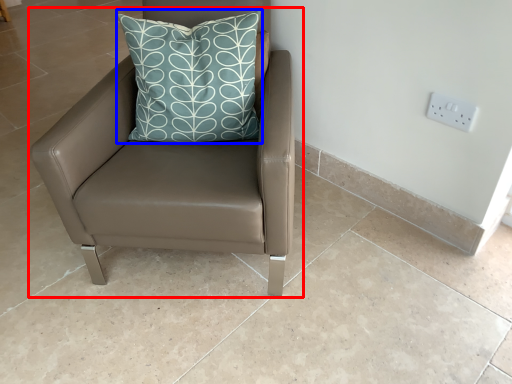
Question: Which of the following is the farthest to the observer, chair (highlighted by a red box) or pillow (highlighted by a blue box)?

Choices:
 (A) chair
 (B) pillow

Answer: (B)